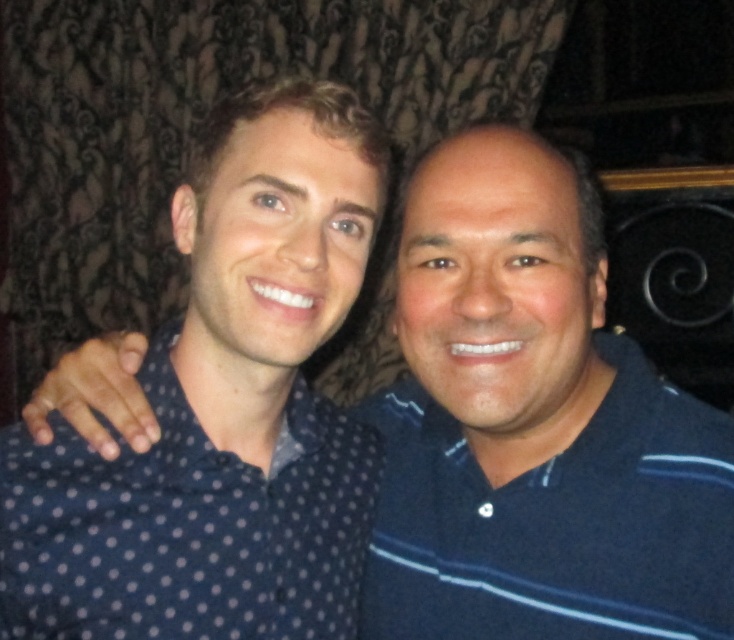
Question: Among these objects, which one is nearest to the camera?

Choices:
 (A) dark blue polka dot shirt at left
 (B) blue striped polo shirt at right

Answer: (A)

Question: Can you confirm if blue striped polo shirt at right is positioned above dark blue polka dot shirt at left?

Choices:
 (A) no
 (B) yes

Answer: (A)

Question: Which point is closer to the camera?

Choices:
 (A) (545, 582)
 (B) (123, 538)

Answer: (B)

Question: Is the position of blue striped polo shirt at right less distant than that of dark blue polka dot shirt at left?

Choices:
 (A) yes
 (B) no

Answer: (B)

Question: Can you confirm if blue striped polo shirt at right is smaller than dark blue polka dot shirt at left?

Choices:
 (A) yes
 (B) no

Answer: (B)

Question: Which point is farther from the camera taking this photo?

Choices:
 (A) (603, 572)
 (B) (228, 499)

Answer: (B)